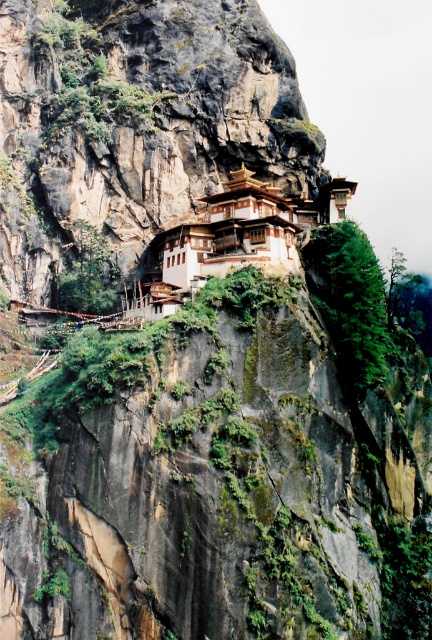
Question: Is brown wooden structure at center smaller than brown wooden monastery at center?

Choices:
 (A) no
 (B) yes

Answer: (A)

Question: Which object is farther from the camera taking this photo?

Choices:
 (A) brown wooden monastery at center
 (B) brown wooden structure at center

Answer: (B)

Question: Observing the image, what is the correct spatial positioning of brown wooden structure at center in reference to brown wooden monastery at center?

Choices:
 (A) below
 (B) above

Answer: (B)

Question: Does brown wooden structure at center lie behind brown wooden monastery at center?

Choices:
 (A) yes
 (B) no

Answer: (A)

Question: Which point is farther to the camera?

Choices:
 (A) brown wooden structure at center
 (B) brown wooden monastery at center

Answer: (A)

Question: Which of the following is the closest to the observer?

Choices:
 (A) (264, 230)
 (B) (259, 70)

Answer: (A)